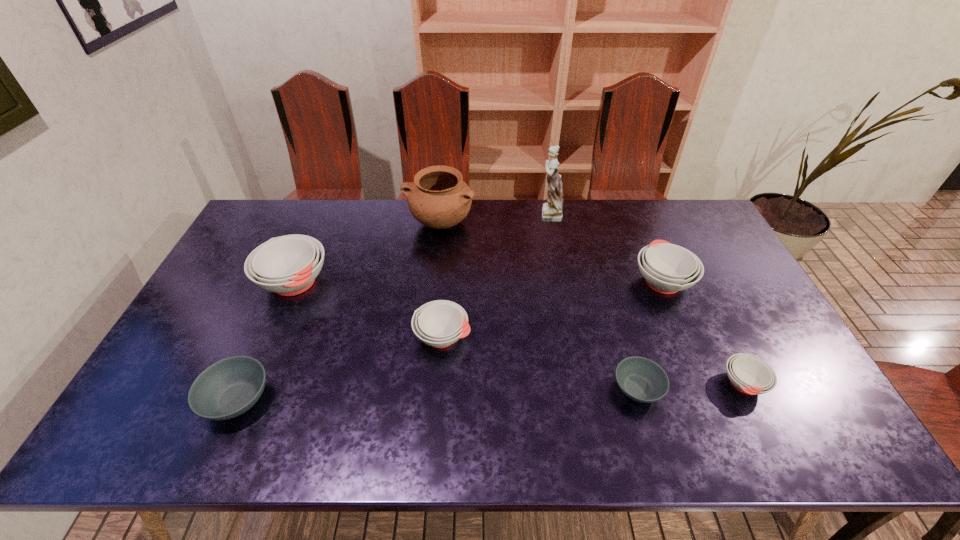
Locate an element on the screen. The image size is (960, 540). free spot between the fourth soup bowl from right to left and the tallest object is located at coordinates (495, 275).

Find the location of a particular element. Image resolution: width=960 pixels, height=540 pixels. vacant area that lies between the nearest white soup bowl and the figurine is located at coordinates (646, 299).

Where is `empty space that is in between the sixth object from left to right and the fourth object from right to left`? empty space that is in between the sixth object from left to right and the fourth object from right to left is located at coordinates (593, 301).

Locate an element on the screen. unoccupied position between the fourth soup bowl from right to left and the second biggest white soup bowl is located at coordinates (552, 308).

Identify the location of the closest object to the seventh shortest object. (552, 211).

At what (x,y) coordinates should I click in order to perform the action: click on object that ranks as the second closest to the left gray soup bowl. Please return your answer as a coordinate pair (x, y). Image resolution: width=960 pixels, height=540 pixels. Looking at the image, I should click on (440, 323).

Identify which soup bowl is the nearest to the third tallest object. Please provide its 2D coordinates. Your answer should be formatted as a tuple, i.e. [(x, y)], where the tuple contains the x and y coordinates of a point satisfying the conditions above.

[(228, 388)]

Point out which soup bowl is positioned as the sixth nearest to the figurine. Please provide its 2D coordinates. Your answer should be formatted as a tuple, i.e. [(x, y)], where the tuple contains the x and y coordinates of a point satisfying the conditions above.

[(228, 388)]

You are a GUI agent. You are given a task and a screenshot of the screen. Output one action in this format:
    pyautogui.click(x=<x>, y=<y>)
    Task: Click on the white soup bowl that is the third closest to the right gray soup bowl
    
    Given the screenshot: What is the action you would take?
    pyautogui.click(x=440, y=323)

Point out which white soup bowl is positioned as the second nearest to the tallest soup bowl. Please provide its 2D coordinates. Your answer should be formatted as a tuple, i.e. [(x, y)], where the tuple contains the x and y coordinates of a point satisfying the conditions above.

[(667, 268)]